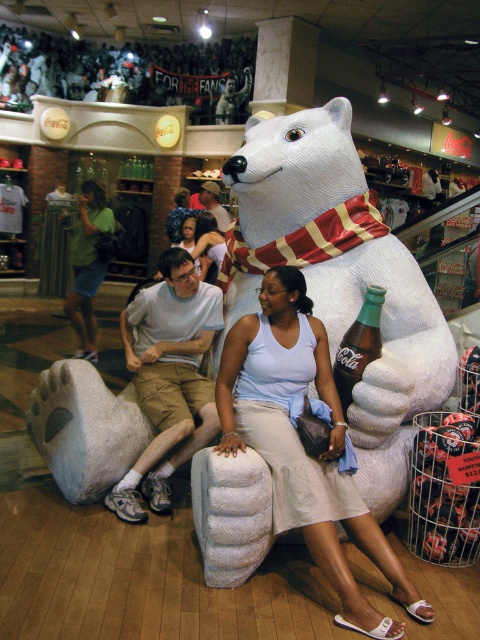
In the scene shown: Can you confirm if white matte polar bear at center is positioned to the left of khaki shorts at center?

No, white matte polar bear at center is not to the left of khaki shorts at center.

Image resolution: width=480 pixels, height=640 pixels. I want to click on white matte polar bear at center, so click(339, 276).

I want to click on white matte polar bear at center, so click(x=339, y=276).

Between point (286, 237) and point (81, 236), which one is positioned behind?

The point (81, 236) is behind.

Image resolution: width=480 pixels, height=640 pixels. What do you see at coordinates (339, 276) in the screenshot?
I see `white matte polar bear at center` at bounding box center [339, 276].

Image resolution: width=480 pixels, height=640 pixels. What are the coordinates of `white matte polar bear at center` in the screenshot? It's located at (339, 276).

Does white matte polar bear at center lie in front of light brown fabric shirt at center?

That is True.

Who is shorter, white matte polar bear at center or light brown fabric shirt at center?

light brown fabric shirt at center is shorter.

Is point (435, 317) closer to viewer compared to point (205, 182)?

Yes.

The image size is (480, 640). I want to click on white matte polar bear at center, so click(x=339, y=276).